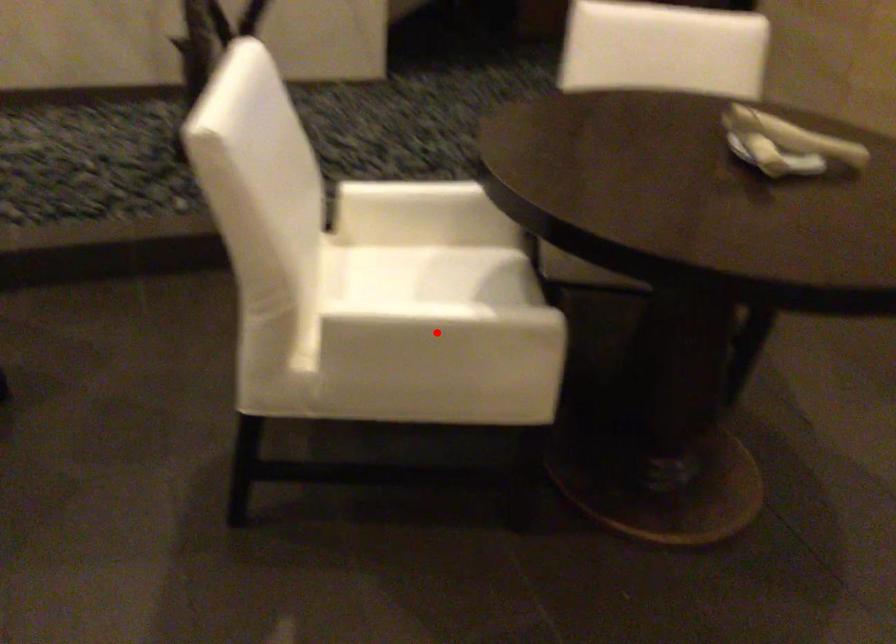
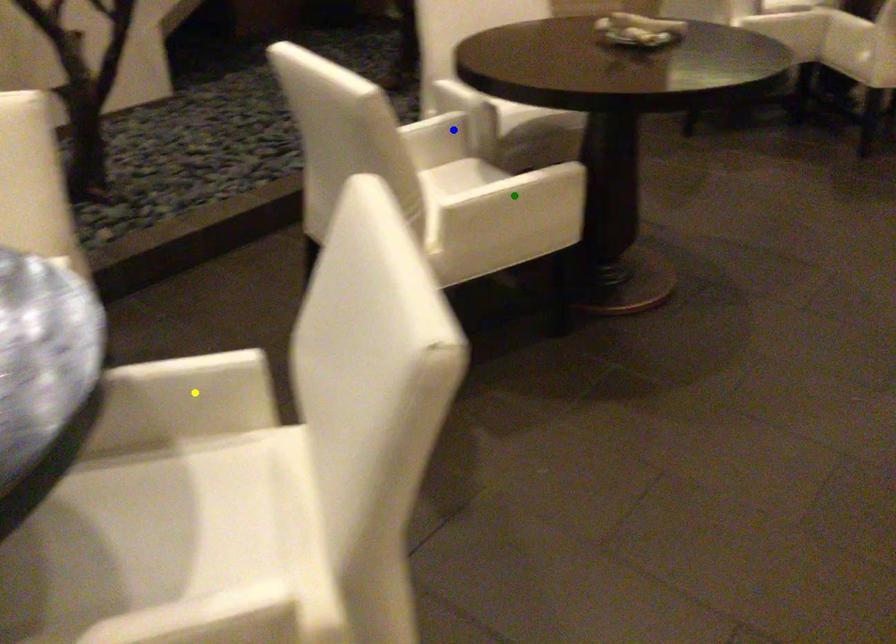
Question: I am providing you with two images of the same scene from different viewpoints. A red point is marked on the first image. You are given multiple points on the second image. Can you choose the point in image 2 that corresponds to the point in image 1?

Choices:
 (A) green point
 (B) yellow point
 (C) blue point

Answer: (A)